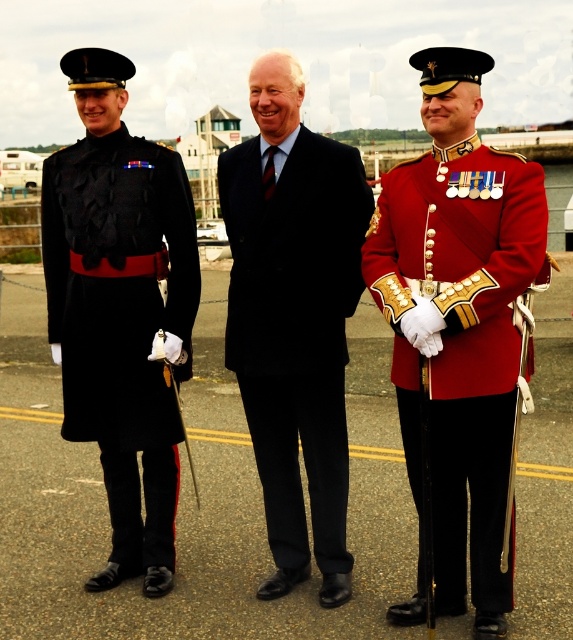
Can you confirm if shiny red fabric jacket at center is positioned below matte black coat at left?

Indeed, shiny red fabric jacket at center is positioned under matte black coat at left.

Who is more distant from viewer, (429, 152) or (107, 172)?

The point (107, 172) is more distant.

Image resolution: width=573 pixels, height=640 pixels. Identify the location of shiny red fabric jacket at center. (461, 340).

Is matte black coat at left shorter than navy wool suit at center?

No.

Is point (131, 416) positioned before point (351, 284)?

No.

Between point (174, 502) and point (304, 448), which one is positioned in front?

Positioned in front is point (304, 448).

I want to click on matte black coat at left, so click(x=121, y=321).

Does shiny red fabric jacket at center lie behind navy wool suit at center?

No, it is in front of navy wool suit at center.

The height and width of the screenshot is (640, 573). What do you see at coordinates (461, 340) in the screenshot?
I see `shiny red fabric jacket at center` at bounding box center [461, 340].

You are a GUI agent. You are given a task and a screenshot of the screen. Output one action in this format:
    pyautogui.click(x=<x>, y=<y>)
    Task: Click on the shiny red fabric jacket at center
    Image resolution: width=573 pixels, height=640 pixels.
    Given the screenshot: What is the action you would take?
    pyautogui.click(x=461, y=340)